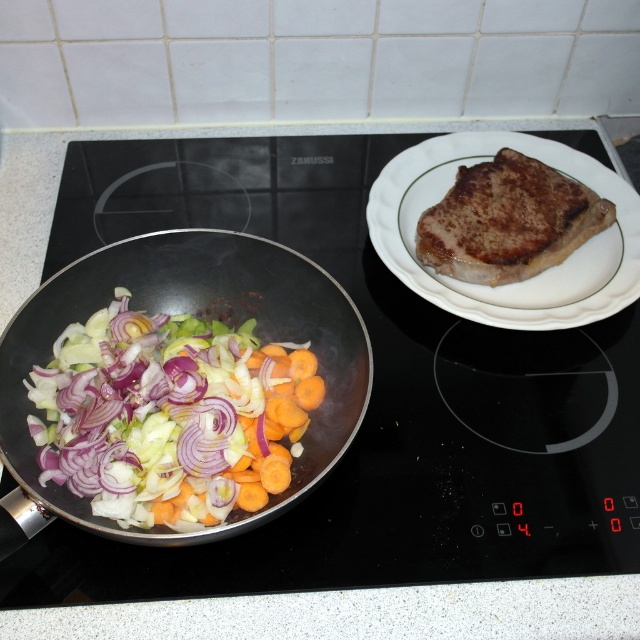
Question: Is the position of black matte wok at left less distant than that of white ceramic plate at upper right?

Choices:
 (A) yes
 (B) no

Answer: (A)

Question: Which object appears closest to the camera in this image?

Choices:
 (A) black matte wok at left
 (B) white ceramic plate at upper right

Answer: (A)

Question: Is black matte wok at left bigger than white ceramic plate at upper right?

Choices:
 (A) no
 (B) yes

Answer: (B)

Question: Where is black matte wok at left located in relation to white ceramic plate at upper right in the image?

Choices:
 (A) below
 (B) above

Answer: (A)